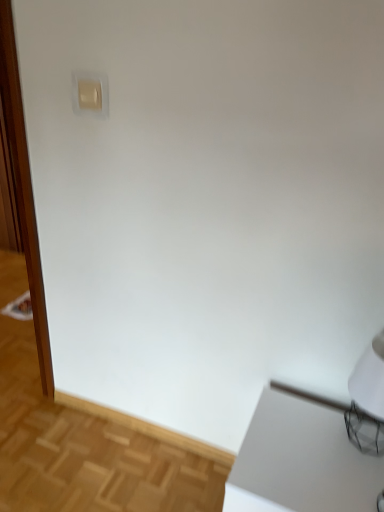
Question: Considering the positions of white matte table lamp at lower right and white glossy screen door at left in the image, is white matte table lamp at lower right taller or shorter than white glossy screen door at left?

Choices:
 (A) tall
 (B) short

Answer: (B)

Question: Is white matte table lamp at lower right to the left or to the right of white glossy screen door at left in the image?

Choices:
 (A) left
 (B) right

Answer: (B)

Question: Estimate the real-world distances between objects in this image. Which object is closer to the white matte table lamp at lower right?

Choices:
 (A) white glossy screen door at left
 (B) beige plastic light switch at upper left
 (C) white glossy table at lower right

Answer: (C)

Question: Estimate the real-world distances between objects in this image. Which object is closer to the beige plastic light switch at upper left?

Choices:
 (A) white glossy screen door at left
 (B) white matte table lamp at lower right
 (C) white glossy table at lower right

Answer: (B)